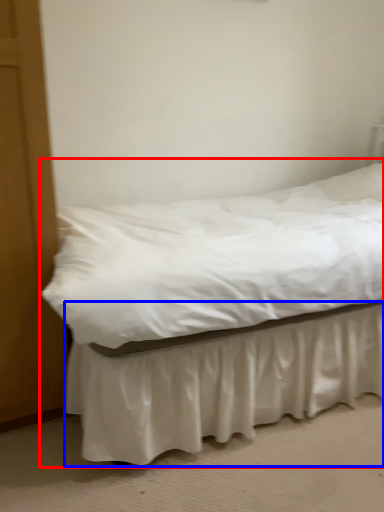
Question: Which object is closer to the camera taking this photo, bed (highlighted by a red box) or bed frame (highlighted by a blue box)?

Choices:
 (A) bed
 (B) bed frame

Answer: (B)